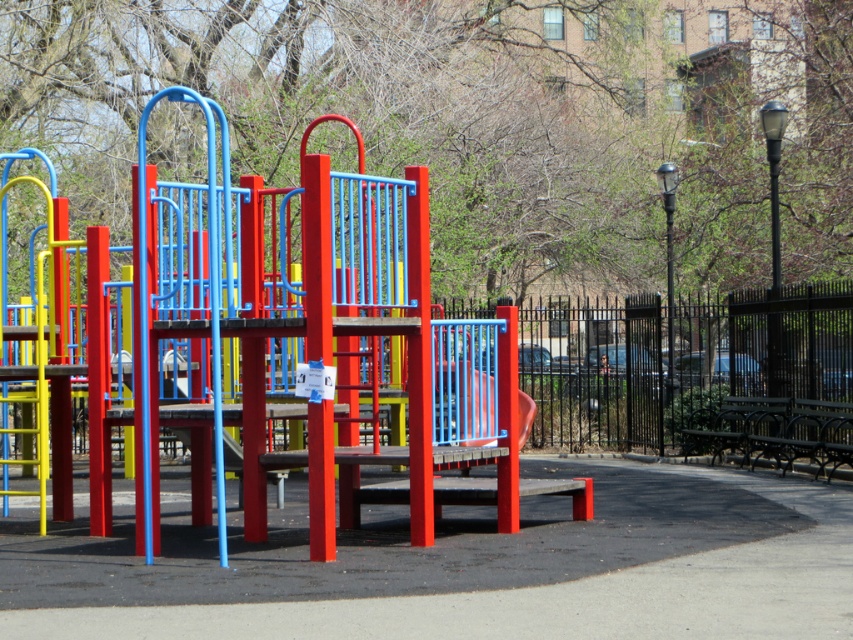
Can you confirm if black polished wood bench at lower right is positioned to the left of smooth plastic slide at center?

In fact, black polished wood bench at lower right is to the right of smooth plastic slide at center.

Locate an element on the screen. This screenshot has width=853, height=640. black polished wood bench at lower right is located at coordinates (801, 433).

Does black polished wood bench at lower right appear over black metal bench at right?

Indeed, black polished wood bench at lower right is positioned over black metal bench at right.

Is black polished wood bench at lower right to the left of black metal bench at right from the viewer's perspective?

Incorrect, black polished wood bench at lower right is not on the left side of black metal bench at right.

Which is behind, point (811, 456) or point (715, 454)?

Point (715, 454)

This screenshot has height=640, width=853. Identify the location of black polished wood bench at lower right. (801, 433).

Does black metal bench at right have a lesser height compared to smooth plastic slide at center?

No, black metal bench at right is not shorter than smooth plastic slide at center.

Does point (778, 429) lie in front of point (503, 429)?

No, it is not.

You are a GUI agent. You are given a task and a screenshot of the screen. Output one action in this format:
    pyautogui.click(x=<x>, y=<y>)
    Task: Click on the black metal bench at right
    The height and width of the screenshot is (640, 853).
    Given the screenshot: What is the action you would take?
    pyautogui.click(x=737, y=426)